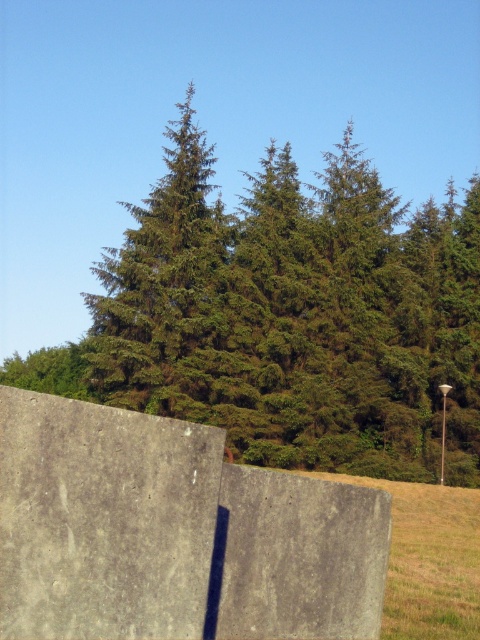
Is green matte tree at center bigger than yellow-green grass at lower right?

Indeed, green matte tree at center has a larger size compared to yellow-green grass at lower right.

Consider the image. Can you confirm if green matte tree at center is positioned to the left of yellow-green grass at lower right?

Indeed, green matte tree at center is positioned on the left side of yellow-green grass at lower right.

Locate an element on the screen. This screenshot has width=480, height=640. green matte tree at center is located at coordinates (288, 316).

Locate an element on the screen. Image resolution: width=480 pixels, height=640 pixels. green matte tree at center is located at coordinates (288, 316).

Between point (156, 257) and point (332, 529), which one is positioned behind?

The point (156, 257) is behind.

Describe the element at coordinates (288, 316) in the screenshot. I see `green matte tree at center` at that location.

Does point (240, 291) come closer to viewer compared to point (24, 541)?

No, (240, 291) is further to viewer.

Where is `green matte tree at center`? This screenshot has height=640, width=480. green matte tree at center is located at coordinates (288, 316).

Describe the element at coordinates (172, 532) in the screenshot. I see `gray concrete wall at center` at that location.

Does point (91, 612) come farther from viewer compared to point (475, 492)?

No, it is in front of (475, 492).

Is point (101, 492) positioned in front of point (478, 618)?

Yes, point (101, 492) is in front of point (478, 618).

Where is `gray concrete wall at center`? gray concrete wall at center is located at coordinates (172, 532).